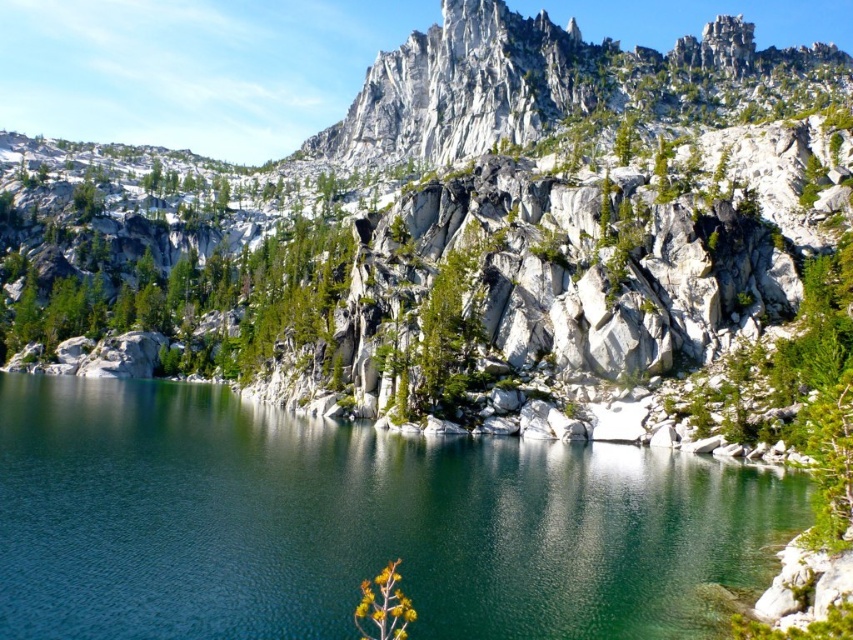
You are a hiker who wants to take a photo of the white rock mountain at upper center and the green glossy water at center from a position where both are visible in the frame. Based on their positions, which object will appear higher in your photo?

The white rock mountain at upper center is positioned over the green glossy water at center, so it will appear higher in the photo.